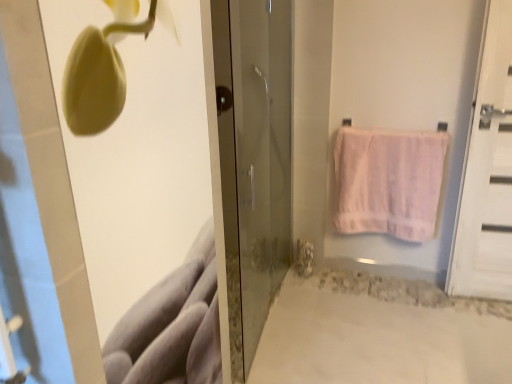
Describe the element at coordinates (388, 182) in the screenshot. I see `pink cotton towel at right` at that location.

Describe the element at coordinates (260, 164) in the screenshot. I see `transparent glass door at center, which is the second door in right-to-left order` at that location.

Based on the photo, what is the approximate width of transparent glass door at center, arranged as the first door when viewed from the left?

The width of transparent glass door at center, arranged as the first door when viewed from the left, is 7.79 inches.

This screenshot has width=512, height=384. What are the coordinates of `pink cotton towel at right` in the screenshot? It's located at [388, 182].

From a real-world perspective, is transparent glass door at center, arranged as the first door when viewed from the left, under pink cotton towel at right?

No.

Can you tell me how much transparent glass door at center, which is the second door in right-to-left order, and pink cotton towel at right differ in facing direction?

They differ by 95.6 degrees in their facing directions.

Is transparent glass door at center, arranged as the first door when viewed from the left, turned away from pink cotton towel at right?

transparent glass door at center, arranged as the first door when viewed from the left, is not turned away from pink cotton towel at right.

From the image's perspective, which door is the 1st one above the pink cotton towel at right? Please provide its 2D coordinates.

[(260, 164)]

Identify the location of door above the white wooden door at right, marked as the 1th door in a right-to-left arrangement (from a real-world perspective). (260, 164).

How different are the orientations of white wooden door at right, which ranks as the second door in left-to-right order, and transparent glass door at center, arranged as the first door when viewed from the left, in degrees?

The angular difference between white wooden door at right, which ranks as the second door in left-to-right order, and transparent glass door at center, arranged as the first door when viewed from the left, is 94.7 degrees.

Which object is wider, white wooden door at right, marked as the 1th door in a right-to-left arrangement, or transparent glass door at center, which is the second door in right-to-left order?

With larger width is transparent glass door at center, which is the second door in right-to-left order.

Which is behind, point (489, 99) or point (245, 238)?

The point (245, 238) is behind.

Could you tell me if pink cotton towel at right is turned towards white wooden door at right, which ranks as the second door in left-to-right order?

No, pink cotton towel at right does not turn towards white wooden door at right, which ranks as the second door in left-to-right order.

Is pink cotton towel at right in front of or behind white wooden door at right, which ranks as the second door in left-to-right order, in the image?

Clearly, pink cotton towel at right is behind white wooden door at right, which ranks as the second door in left-to-right order.

Would you consider pink cotton towel at right to be distant from white wooden door at right, marked as the 1th door in a right-to-left arrangement?

pink cotton towel at right is near white wooden door at right, marked as the 1th door in a right-to-left arrangement, not far away.

From a real-world perspective, is pink cotton towel at right under white wooden door at right, which ranks as the second door in left-to-right order?

Yes.

From the image's perspective, is transparent glass door at center, which is the second door in right-to-left order, beneath white wooden door at right, which ranks as the second door in left-to-right order?

Correct, transparent glass door at center, which is the second door in right-to-left order, appears lower than white wooden door at right, which ranks as the second door in left-to-right order, in the image.

Relative to white wooden door at right, marked as the 1th door in a right-to-left arrangement, is transparent glass door at center, arranged as the first door when viewed from the left, in front or behind?

In the image, transparent glass door at center, arranged as the first door when viewed from the left, appears in front of white wooden door at right, marked as the 1th door in a right-to-left arrangement.

Can you confirm if transparent glass door at center, arranged as the first door when viewed from the left, is smaller than white wooden door at right, marked as the 1th door in a right-to-left arrangement?

No.

Is transparent glass door at center, which is the second door in right-to-left order, taller than white wooden door at right, marked as the 1th door in a right-to-left arrangement?

Correct, transparent glass door at center, which is the second door in right-to-left order, is much taller as white wooden door at right, marked as the 1th door in a right-to-left arrangement.

Measure the distance from pink cotton towel at right to transparent glass door at center, which is the second door in right-to-left order.

24.81 inches.

Consider the image. Does pink cotton towel at right appear on the left side of transparent glass door at center, arranged as the first door when viewed from the left?

No.

Is pink cotton towel at right bigger than transparent glass door at center, arranged as the first door when viewed from the left?

Actually, pink cotton towel at right might be smaller than transparent glass door at center, arranged as the first door when viewed from the left.

Can you confirm if pink cotton towel at right is thinner than transparent glass door at center, which is the second door in right-to-left order?

Correct, the width of pink cotton towel at right is less than that of transparent glass door at center, which is the second door in right-to-left order.

Is pink cotton towel at right surrounded by white wooden door at right, which ranks as the second door in left-to-right order?

No.

Does point (511, 112) come in front of point (403, 171)?

Yes, point (511, 112) is in front of point (403, 171).

How distant is white wooden door at right, marked as the 1th door in a right-to-left arrangement, from pink cotton towel at right?

white wooden door at right, marked as the 1th door in a right-to-left arrangement, is 15.28 inches away from pink cotton towel at right.

This screenshot has height=384, width=512. I want to click on towel below the white wooden door at right, which ranks as the second door in left-to-right order (from the image's perspective), so click(388, 182).

Where is `door that is the 2nd one above the pink cotton towel at right (from a real-world perspective)`? door that is the 2nd one above the pink cotton towel at right (from a real-world perspective) is located at coordinates pos(260,164).

What are the coordinates of `door that is on the left side of white wooden door at right, which ranks as the second door in left-to-right order` in the screenshot? It's located at (260, 164).

Looking at the image, which one is located closer to transparent glass door at center, arranged as the first door when viewed from the left, pink cotton towel at right or white wooden door at right, which ranks as the second door in left-to-right order?

Among the two, pink cotton towel at right is located nearer to transparent glass door at center, arranged as the first door when viewed from the left.

When comparing their distances from pink cotton towel at right, does transparent glass door at center, arranged as the first door when viewed from the left, or white wooden door at right, which ranks as the second door in left-to-right order, seem closer?

The object closer to pink cotton towel at right is white wooden door at right, which ranks as the second door in left-to-right order.

Based on their spatial positions, is transparent glass door at center, which is the second door in right-to-left order, or pink cotton towel at right closer to white wooden door at right, which ranks as the second door in left-to-right order?

pink cotton towel at right is closer to white wooden door at right, which ranks as the second door in left-to-right order.

Estimate the real-world distances between objects in this image. Which object is further from transparent glass door at center, arranged as the first door when viewed from the left, white wooden door at right, marked as the 1th door in a right-to-left arrangement, or pink cotton towel at right?

white wooden door at right, marked as the 1th door in a right-to-left arrangement.

Estimate the real-world distances between objects in this image. Which object is further from pink cotton towel at right, white wooden door at right, which ranks as the second door in left-to-right order, or transparent glass door at center, which is the second door in right-to-left order?

transparent glass door at center, which is the second door in right-to-left order, is positioned further to the anchor pink cotton towel at right.

Estimate the real-world distances between objects in this image. Which object is closer to white wooden door at right, marked as the 1th door in a right-to-left arrangement, pink cotton towel at right or transparent glass door at center, arranged as the first door when viewed from the left?

The object closer to white wooden door at right, marked as the 1th door in a right-to-left arrangement, is pink cotton towel at right.

Locate an element on the screen. This screenshot has height=384, width=512. towel between transparent glass door at center, which is the second door in right-to-left order, and white wooden door at right, which ranks as the second door in left-to-right order, from left to right is located at coordinates (388, 182).